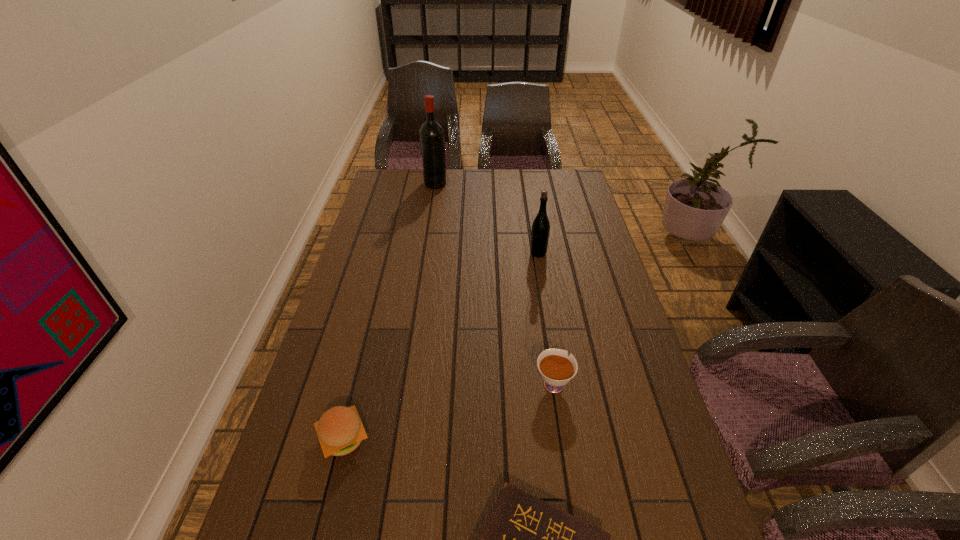
The width and height of the screenshot is (960, 540). I want to click on free space located on the side of the third nearest object with the handle, so click(548, 351).

In order to click on blank space located on the side of the third nearest object with the handle in this screenshot , I will do `click(544, 320)`.

The image size is (960, 540). Identify the location of free space located on the right of the second nearest object. (468, 438).

At what (x,y) coordinates should I click in order to perform the action: click on object positioned at the far edge. Please return your answer as a coordinate pair (x, y). Looking at the image, I should click on click(x=432, y=140).

In order to click on object at the left edge in this screenshot , I will do `click(340, 431)`.

Where is `vacant space at the far edge of the desktop`? This screenshot has height=540, width=960. vacant space at the far edge of the desktop is located at coordinates (506, 172).

At what (x,y) coordinates should I click in order to perform the action: click on vacant space at the left edge. Please return your answer as a coordinate pair (x, y). Looking at the image, I should click on (366, 219).

The width and height of the screenshot is (960, 540). I want to click on free space at the right edge, so click(x=632, y=466).

Where is `vacant space that's between the wine bottle and the third nearest object`? vacant space that's between the wine bottle and the third nearest object is located at coordinates (494, 283).

Where is `vacant area that lies between the third nearest object and the wine bottle`? vacant area that lies between the third nearest object and the wine bottle is located at coordinates (494, 283).